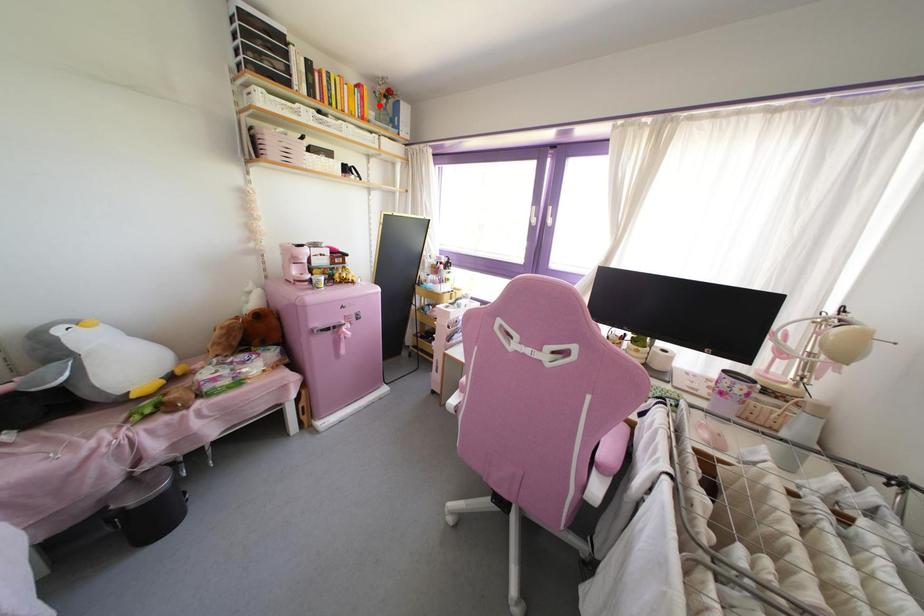
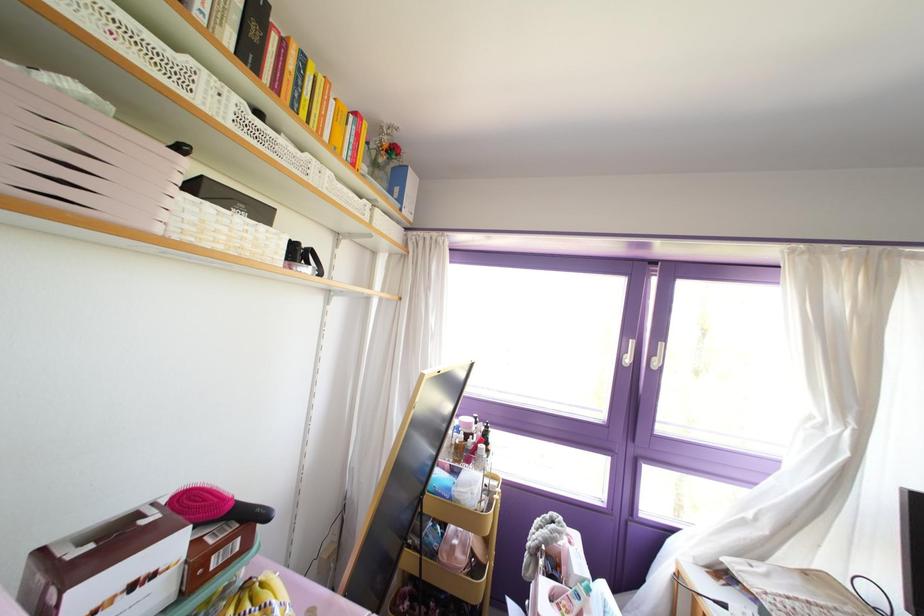
The point at the highlighted location is marked in the first image. Where is the corresponding point in the second image?

(372, 163)